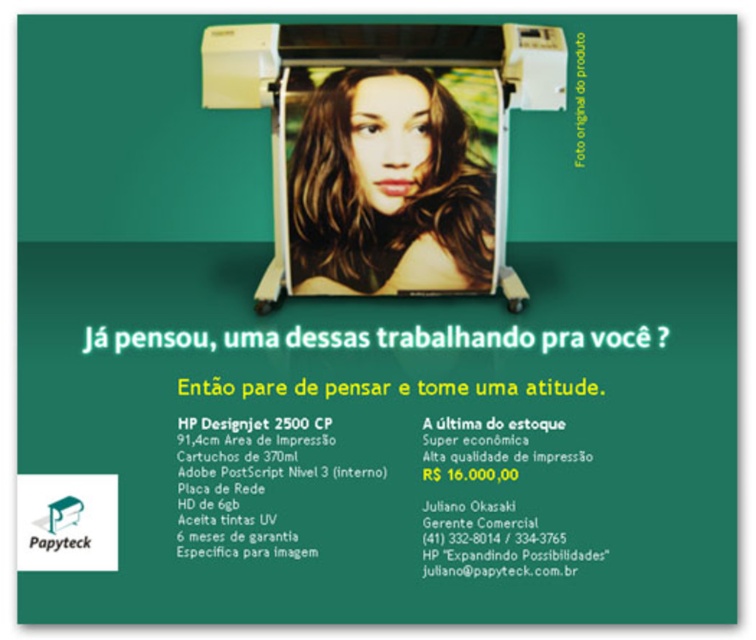
Question: Which point appears closest to the camera in this image?

Choices:
 (A) (409, 160)
 (B) (335, 284)

Answer: (A)

Question: Is white plastic printer at center below shiny brown hair at center?

Choices:
 (A) no
 (B) yes

Answer: (A)

Question: In this image, where is white plastic printer at center located relative to shiny brown hair at center?

Choices:
 (A) left
 (B) right

Answer: (B)

Question: Does white plastic printer at center appear under shiny brown hair at center?

Choices:
 (A) no
 (B) yes

Answer: (A)

Question: Which point is closer to the camera?

Choices:
 (A) (380, 198)
 (B) (389, 291)

Answer: (A)